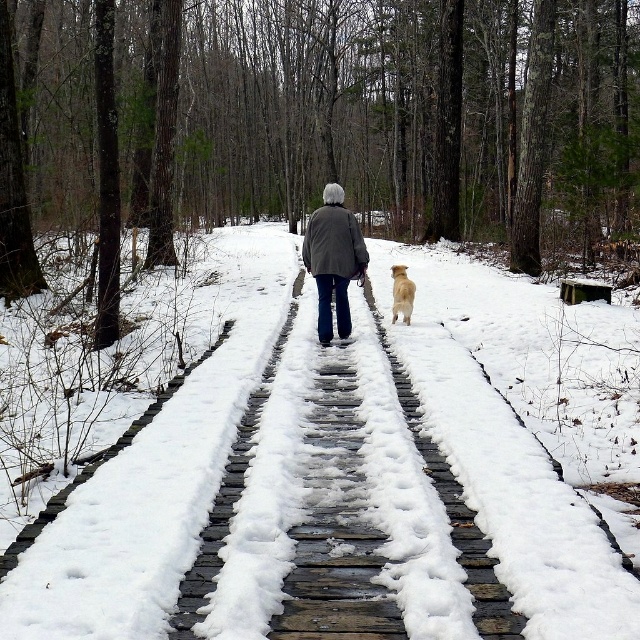
You are standing at the point labeled point (x=392, y=284) and want to walk towards the elderly person in the center of the boardwalk. Is the point labeled point (x=387, y=602) located in front of or behind your current position?

The point labeled point (x=387, y=602) is in front of your current position at point (x=392, y=284) because it is described as being in front of it according to the spatial relationship provided.